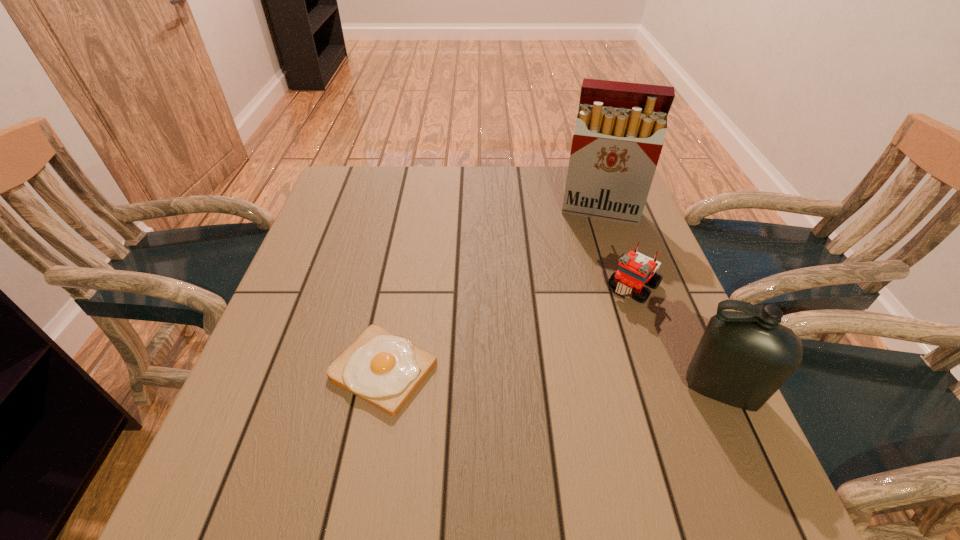
Select which object appears as the third closest to the second tallest object. Please provide its 2D coordinates. Your answer should be formatted as a tuple, i.e. [(x, y)], where the tuple contains the x and y coordinates of a point satisfying the conditions above.

[(383, 369)]

The height and width of the screenshot is (540, 960). Identify the location of object that ranks as the closest to the shortest object. (635, 269).

The image size is (960, 540). I want to click on vacant space that satisfies the following two spatial constraints: 1. on the back side of the toast; 2. on the left side of the farthest object, so click(414, 210).

Where is `vacant region that satisfies the following two spatial constraints: 1. on the front side of the tallest object; 2. on the right side of the third nearest object`? vacant region that satisfies the following two spatial constraints: 1. on the front side of the tallest object; 2. on the right side of the third nearest object is located at coordinates (627, 286).

The height and width of the screenshot is (540, 960). Find the location of `vacant position in the image that satisfies the following two spatial constraints: 1. on the back side of the tallest object; 2. on the right side of the shortest object`. vacant position in the image that satisfies the following two spatial constraints: 1. on the back side of the tallest object; 2. on the right side of the shortest object is located at coordinates (414, 210).